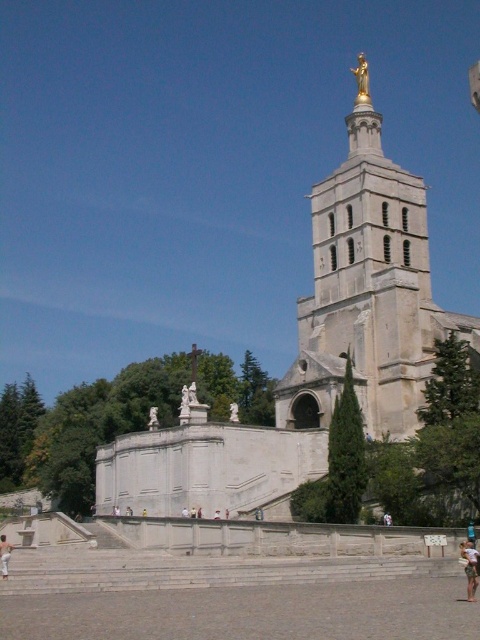
Question: Which object appears closest to the camera in this image?

Choices:
 (A) gold metallic statue at upper center
 (B) white stone statue at center
 (C) light brown wooden surfboard at lower right
 (D) white stone church at center

Answer: (C)

Question: Which point is closer to the camera?

Choices:
 (A) white stone church at center
 (B) gold metallic statue at upper center

Answer: (A)

Question: Can you confirm if white stone church at center is smaller than light brown wooden surfboard at lower right?

Choices:
 (A) no
 (B) yes

Answer: (A)

Question: Among these points, which one is farthest from the camera?

Choices:
 (A) (363, 72)
 (B) (415, 362)
 (C) (215, 516)

Answer: (A)

Question: Is light brown skin at lower left smaller than white stone statue at center?

Choices:
 (A) no
 (B) yes

Answer: (A)

Question: Is light brown wooden surfboard at lower right smaller than gold metallic statue at upper center?

Choices:
 (A) no
 (B) yes

Answer: (B)